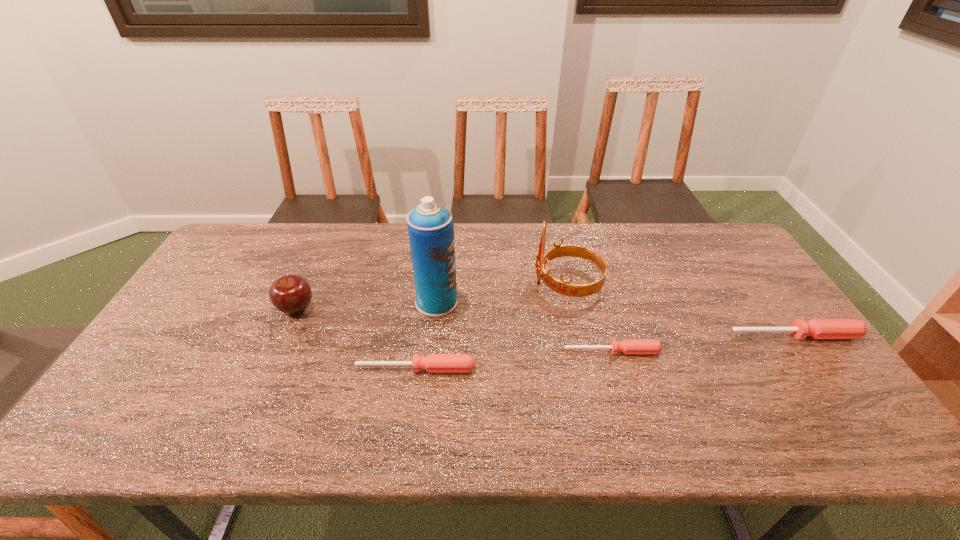
Find the location of `vacant area in the image that satisfies the following two spatial constraints: 1. on the front-facing side of the tiara; 2. on the back side of the rightmost object`. vacant area in the image that satisfies the following two spatial constraints: 1. on the front-facing side of the tiara; 2. on the back side of the rightmost object is located at coordinates (579, 335).

At what (x,y) coordinates should I click in order to perform the action: click on free space that satisfies the following two spatial constraints: 1. on the back side of the third tallest object; 2. on the right side of the aerosol can. Please return your answer as a coordinate pair (x, y). The image size is (960, 540). Looking at the image, I should click on (300, 301).

Find the location of a particular element. vacant space that satisfies the following two spatial constraints: 1. on the front-facing side of the third nearest object; 2. on the right side of the second tallest object is located at coordinates (579, 335).

Find the location of a particular element. The width and height of the screenshot is (960, 540). vacant point that satisfies the following two spatial constraints: 1. on the front-facing side of the fifth shortest object; 2. on the back side of the rightmost screwdriver is located at coordinates [579, 335].

Where is `free space that satisfies the following two spatial constraints: 1. on the front side of the tallest object; 2. on the left side of the second farthest screwdriver`? free space that satisfies the following two spatial constraints: 1. on the front side of the tallest object; 2. on the left side of the second farthest screwdriver is located at coordinates (431, 352).